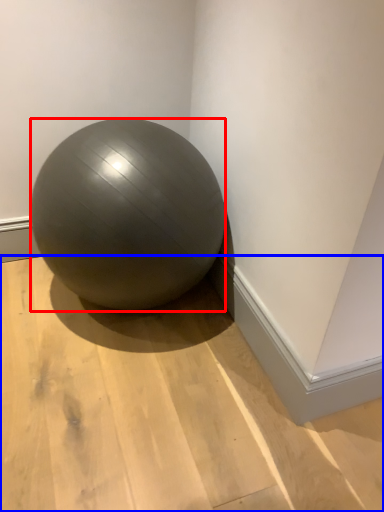
Question: Which object is further to the camera taking this photo, ball (highlighted by a red box) or surface (highlighted by a blue box)?

Choices:
 (A) ball
 (B) surface

Answer: (A)